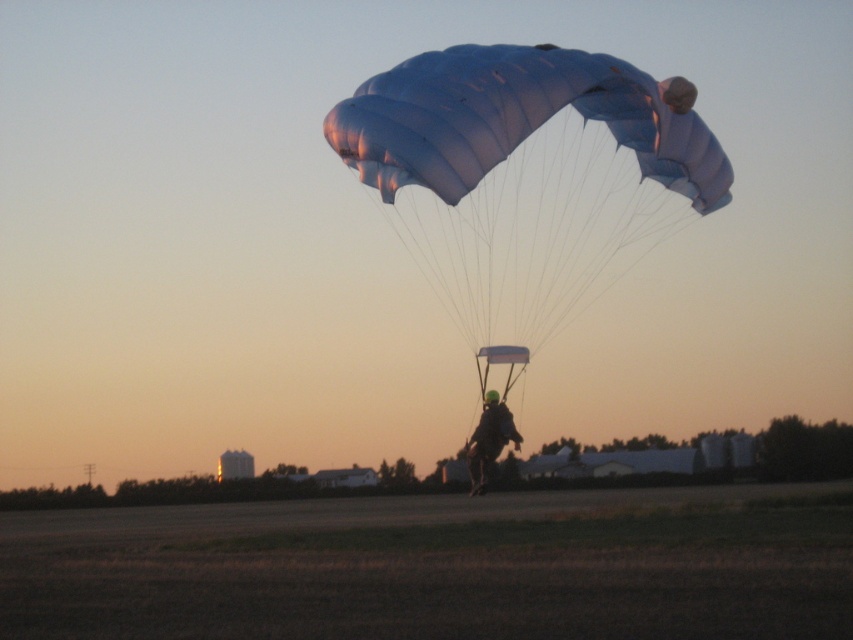
Which of these two, translucent nylon parachute at upper center or matte black helmet at center, stands taller?

With more height is translucent nylon parachute at upper center.

What do you see at coordinates (527, 177) in the screenshot?
I see `translucent nylon parachute at upper center` at bounding box center [527, 177].

The height and width of the screenshot is (640, 853). What are the coordinates of `translucent nylon parachute at upper center` in the screenshot? It's located at (527, 177).